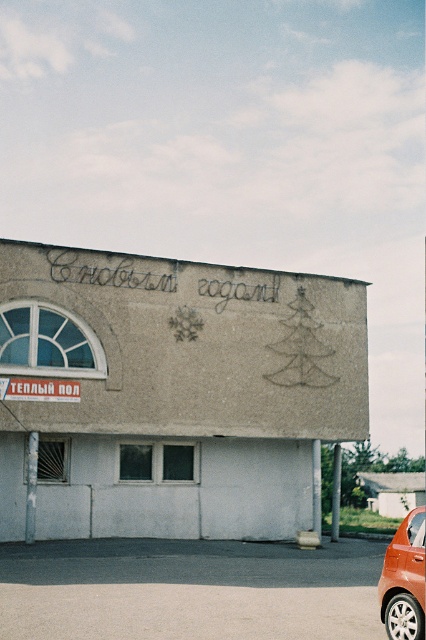
In the scene shown: You are standing 10 meters away from a building. You notice a specific point marked at coordinates point (x=405, y=627). Can you determine if this point is closer to you or farther than your current distance?

The distance of point (x=405, y=627) from camera is 9.78 meters, which is slightly closer than your current 10 meters distance.

You are a pedestrian standing in front of the building. You see an orange matte car at lower right and a white plastic sign at upper left. Which object is located to the right side of the other?

The orange matte car at lower right is to the right of the white plastic sign at upper left.

You are standing in front of the building shown in the image. You see two points marked on the wall. The first point is at coordinate point(423, 564) and the second point is at coordinate point(8, 385). Which point is closer to you?

Point(423, 564) is in front of point0.021, so you are closer to point(423, 564).